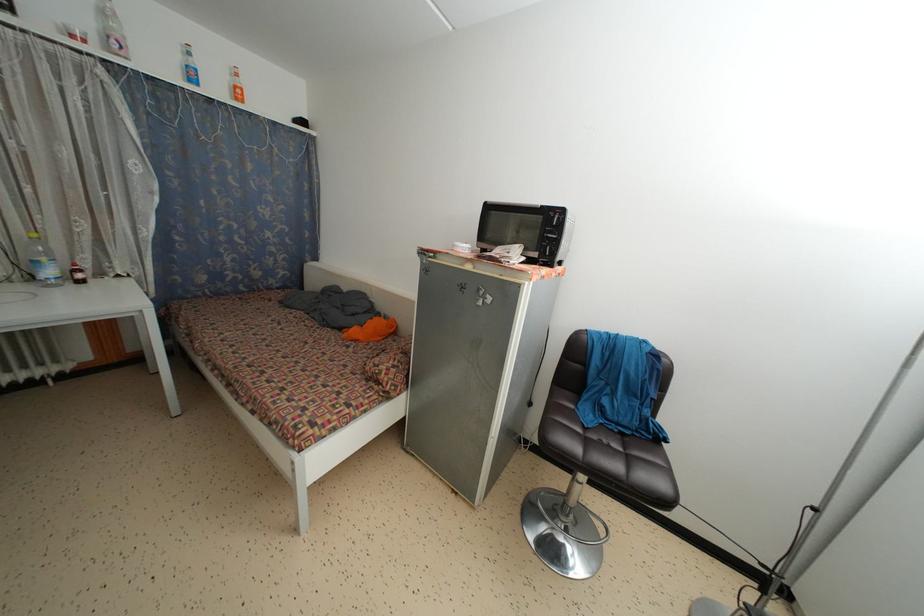
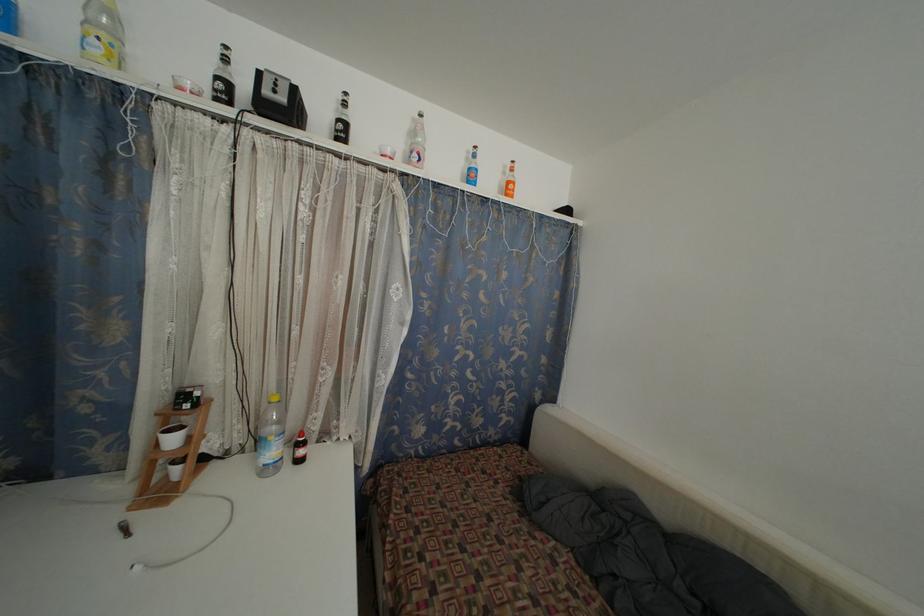
Locate, in the second image, the point that corresponds to (x=239, y=92) in the first image.

(513, 188)